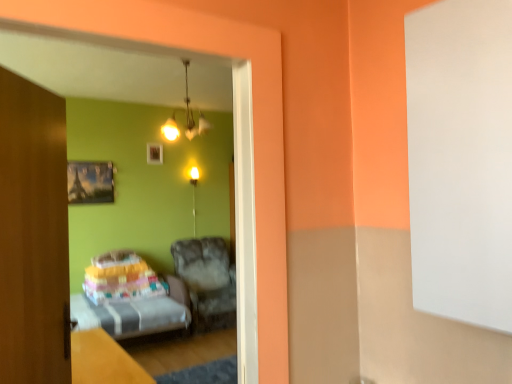
What do you see at coordinates (103, 360) in the screenshot? Image resolution: width=512 pixels, height=384 pixels. I see `wooden table at lower left` at bounding box center [103, 360].

Where is `transparent glass door at left`? Image resolution: width=512 pixels, height=384 pixels. transparent glass door at left is located at coordinates (132, 77).

This screenshot has height=384, width=512. What do you see at coordinates (154, 153) in the screenshot?
I see `wooden picture frame at upper center, the second picture frame in the left-to-right sequence` at bounding box center [154, 153].

Describe the element at coordinates (33, 235) in the screenshot. I see `wooden door at left` at that location.

The image size is (512, 384). Identify the location of matte white chandelier at upper center. (192, 112).

Between transparent glass door at left and fuzzy fabric armchair at center, which is counted as the second furniture, starting from the left, which one has larger size?

With larger size is fuzzy fabric armchair at center, which is counted as the second furniture, starting from the left.

Considering the relative positions of transparent glass door at left and fuzzy fabric armchair at center, which is counted as the second furniture, starting from the left, in the image provided, is transparent glass door at left to the right of fuzzy fabric armchair at center, which is counted as the second furniture, starting from the left, from the viewer's perspective?

Yes.

Is transparent glass door at left positioned with its back to fuzzy fabric armchair at center, which is counted as the second furniture, starting from the left?

No, transparent glass door at left is not facing the opposite direction of fuzzy fabric armchair at center, which is counted as the second furniture, starting from the left.

Considering the positions of objects matte white chandelier at upper center and metallic silver picture frame at upper left, which is the 1th picture frame from bottom to top, in the image provided, who is more to the right, matte white chandelier at upper center or metallic silver picture frame at upper left, which is the 1th picture frame from bottom to top,?

matte white chandelier at upper center is more to the right.

Between matte white chandelier at upper center and metallic silver picture frame at upper left, which is the 1th picture frame from bottom to top, which one has larger size?

Bigger between the two is matte white chandelier at upper center.

Is matte white chandelier at upper center situated inside metallic silver picture frame at upper left, the 1th picture frame positioned from the left, or outside?

matte white chandelier at upper center exists outside the volume of metallic silver picture frame at upper left, the 1th picture frame positioned from the left.

From a real-world perspective, which object rests below the other?

metallic silver picture frame at upper left, the second picture frame positioned from the top, is physically lower.

From a real-world perspective, is matte gold light fixture at center physically below wooden door at left?

No, from a real-world perspective, matte gold light fixture at center is not under wooden door at left.

Is point (195, 210) positioned behind point (52, 180)?

Yes, it is.

From the picture: Could you tell me if matte gold light fixture at center is facing wooden door at left?

No, matte gold light fixture at center is not oriented towards wooden door at left.

Considering the sizes of matte gold light fixture at center and wooden door at left in the image, is matte gold light fixture at center bigger or smaller than wooden door at left?

Clearly, matte gold light fixture at center is smaller in size than wooden door at left.

Is matte gold light fixture at center oriented away from metallic silver picture frame at upper left, the second picture frame viewed from the back?

No.

The image size is (512, 384). In order to click on light fixture below the metallic silver picture frame at upper left, which is counted as the first picture frame, starting from the front (from a real-world perspective) in this screenshot , I will do `click(194, 193)`.

Relative to metallic silver picture frame at upper left, which is the 1th picture frame from bottom to top, is matte gold light fixture at center in front or behind?

In the image, matte gold light fixture at center appears behind metallic silver picture frame at upper left, which is the 1th picture frame from bottom to top.

Considering the sizes of matte gold light fixture at center and metallic silver picture frame at upper left, which is counted as the first picture frame, starting from the front, in the image, is matte gold light fixture at center wider or thinner than metallic silver picture frame at upper left, which is counted as the first picture frame, starting from the front,?

Considering their sizes, matte gold light fixture at center looks slimmer than metallic silver picture frame at upper left, which is counted as the first picture frame, starting from the front.

Can you see fuzzy fabric armchair at center, the 1th furniture when ordered from right to left, touching multicolored fabric bed at lower left, the second furniture from the right?

fuzzy fabric armchair at center, the 1th furniture when ordered from right to left, and multicolored fabric bed at lower left, the second furniture from the right, are not in contact.

From the image's perspective, is fuzzy fabric armchair at center, the 1th furniture when ordered from right to left, beneath multicolored fabric bed at lower left, the 1th furniture from the left?

Indeed, from the image's perspective, fuzzy fabric armchair at center, the 1th furniture when ordered from right to left, is shown beneath multicolored fabric bed at lower left, the 1th furniture from the left.

How different are the orientations of fuzzy fabric armchair at center, the 1th furniture when ordered from right to left, and multicolored fabric bed at lower left, the second furniture from the right, in degrees?

The angle between the facing direction of fuzzy fabric armchair at center, the 1th furniture when ordered from right to left, and the facing direction of multicolored fabric bed at lower left, the second furniture from the right, is 5.92e-05 degrees.

From the image's perspective, is matte gold light fixture at center below wooden table at lower left?

Incorrect, from the image's perspective, matte gold light fixture at center is higher than wooden table at lower left.

How different are the orientations of matte gold light fixture at center and wooden table at lower left in degrees?

The angle between the facing direction of matte gold light fixture at center and the facing direction of wooden table at lower left is 91.8 degrees.

Would you say wooden table at lower left is part of matte gold light fixture at center's contents?

Definitely not — wooden table at lower left is not inside matte gold light fixture at center.

Is matte gold light fixture at center turned away from wooden table at lower left?

matte gold light fixture at center is not turned away from wooden table at lower left.

Is wooden door at left not close to matte gold light fixture at center?

Absolutely, wooden door at left is distant from matte gold light fixture at center.

Can you confirm if wooden door at left is taller than matte gold light fixture at center?

Indeed, wooden door at left has a greater height compared to matte gold light fixture at center.

Can matte gold light fixture at center be found inside wooden door at left?

No, matte gold light fixture at center is located outside of wooden door at left.

Is point (42, 369) more distant than point (191, 175)?

No, it is not.

The image size is (512, 384). I want to click on glass door that appears in front of the fuzzy fabric armchair at center, the 1th furniture when ordered from right to left, so click(x=132, y=77).

Identify the location of chandelier above the metallic silver picture frame at upper left, placed as the second picture frame when sorted from right to left (from a real-world perspective). tap(192, 112).

Which object lies further to the anchor point wooden door at left, wooden table at lower left or wooden picture frame at upper center, marked as the 2th picture frame in a front-to-back arrangement?

wooden picture frame at upper center, marked as the 2th picture frame in a front-to-back arrangement.

Estimate the real-world distances between objects in this image. Which object is closer to metallic silver picture frame at upper left, which is counted as the first picture frame, starting from the front, matte gold light fixture at center or multicolored fabric bed at lower left, the 1th furniture from the left?

matte gold light fixture at center.

Estimate the real-world distances between objects in this image. Which object is closer to wooden door at left, matte gold light fixture at center or multicolored fabric bed at lower left, the 1th furniture from the left?

Among the two, multicolored fabric bed at lower left, the 1th furniture from the left, is located nearer to wooden door at left.

Looking at the image, which one is located closer to transparent glass door at left, metallic silver picture frame at upper left, the second picture frame positioned from the top, or wooden door at left?

metallic silver picture frame at upper left, the second picture frame positioned from the top, is closer to transparent glass door at left.

Looking at this image, considering their positions, is wooden table at lower left positioned closer to multicolored fabric bed at lower left, the second furniture from the right, than wooden picture frame at upper center, positioned as the first picture frame in top-to-bottom order?

Based on the image, wooden table at lower left appears to be nearer to multicolored fabric bed at lower left, the second furniture from the right.

Based on their spatial positions, is matte gold light fixture at center or fuzzy fabric armchair at center, the 1th furniture when ordered from right to left, further from wooden table at lower left?

matte gold light fixture at center lies further to wooden table at lower left than the other object.

Estimate the real-world distances between objects in this image. Which object is closer to multicolored fabric bed at lower left, the second furniture from the right, fuzzy fabric armchair at center, which is counted as the second furniture, starting from the left, or wooden picture frame at upper center, which is the second picture frame from bottom to top?

Based on the image, fuzzy fabric armchair at center, which is counted as the second furniture, starting from the left, appears to be nearer to multicolored fabric bed at lower left, the second furniture from the right.

Looking at the image, which one is located further to metallic silver picture frame at upper left, placed as the second picture frame when sorted from right to left, multicolored fabric bed at lower left, the 1th furniture from the left, or matte gold light fixture at center?

The object further to metallic silver picture frame at upper left, placed as the second picture frame when sorted from right to left, is multicolored fabric bed at lower left, the 1th furniture from the left.

Locate an element on the screen. This screenshot has width=512, height=384. door between transparent glass door at left and multicolored fabric bed at lower left, the 1th furniture from the left, in the front-back direction is located at coordinates 33,235.

At what (x,y) coordinates should I click in order to perform the action: click on table located between transparent glass door at left and metallic silver picture frame at upper left, which is counted as the first picture frame, starting from the front, in the depth direction. Please return your answer as a coordinate pair (x, y). The image size is (512, 384). Looking at the image, I should click on (103, 360).

Where is `chandelier between transparent glass door at left and wooden picture frame at upper center, the first picture frame when ordered from right to left, from front to back`? This screenshot has height=384, width=512. chandelier between transparent glass door at left and wooden picture frame at upper center, the first picture frame when ordered from right to left, from front to back is located at coordinates (192, 112).

Image resolution: width=512 pixels, height=384 pixels. Find the location of `table between transparent glass door at left and multicolored fabric bed at lower left, the 1th furniture from the left, along the z-axis`. table between transparent glass door at left and multicolored fabric bed at lower left, the 1th furniture from the left, along the z-axis is located at coordinates (103, 360).